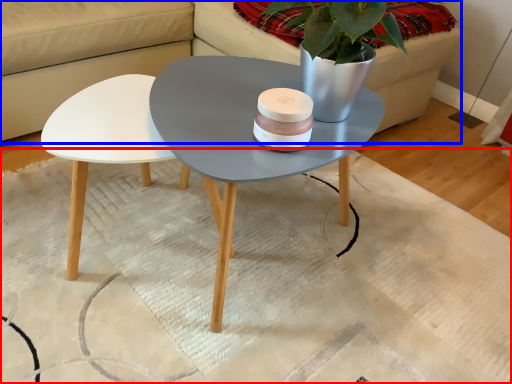
Question: Among these objects, which one is nearest to the camera, mat (highlighted by a red box) or couch (highlighted by a blue box)?

Choices:
 (A) mat
 (B) couch

Answer: (A)